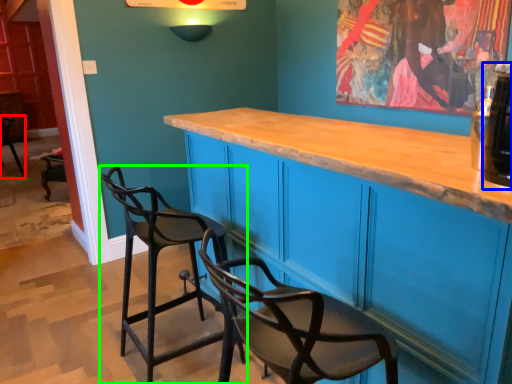
Question: Which is farther away from chair (highlighted by a red box)? beverage (highlighted by a blue box) or chair (highlighted by a green box)?

Choices:
 (A) beverage
 (B) chair

Answer: (A)